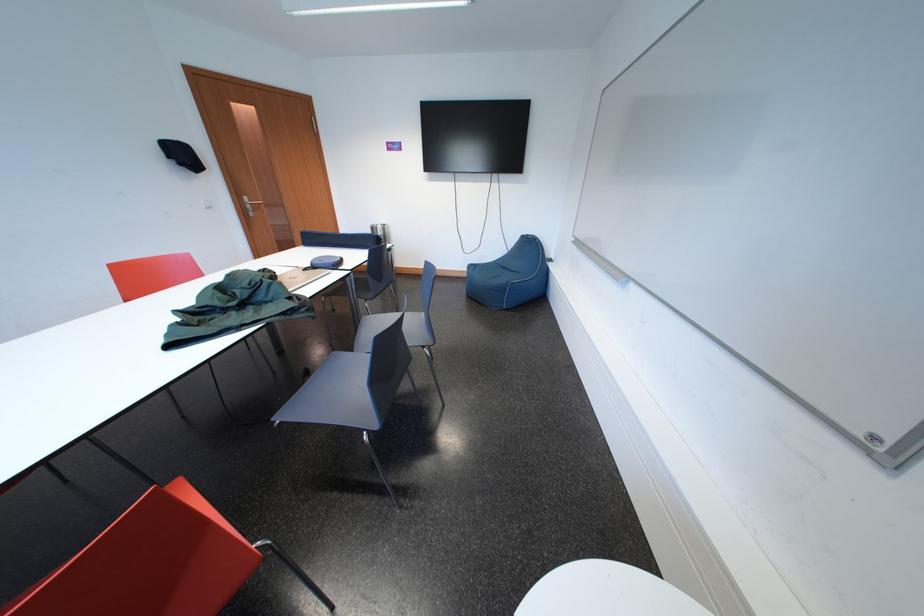
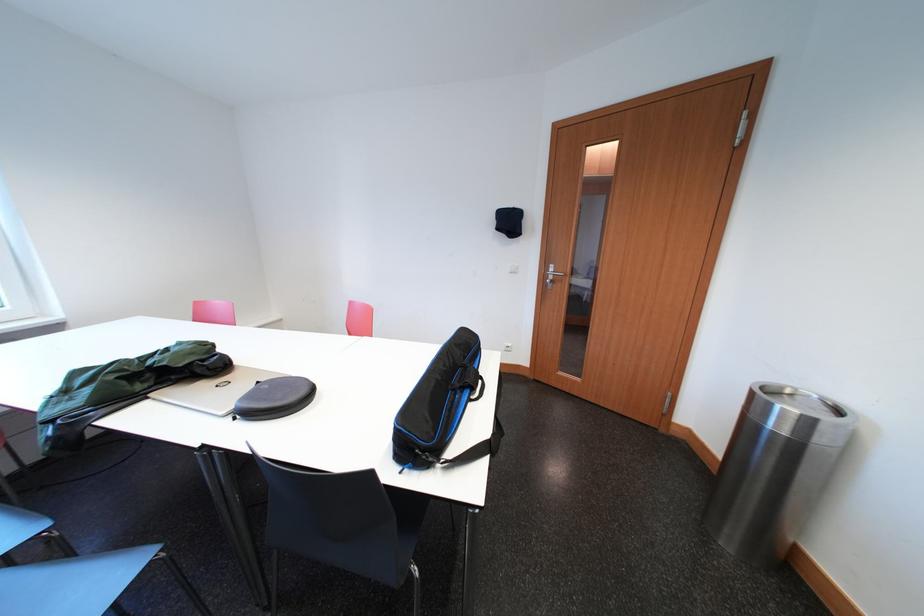
Where in the second image is the point corresponding to point 393,233 from the first image?

(819, 426)